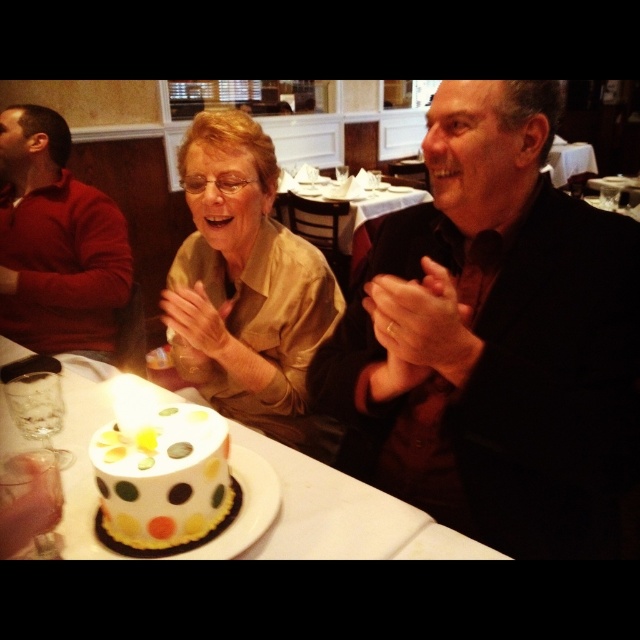
Which is in front, point (12, 205) or point (193, 428)?

Point (193, 428) is more forward.

Find the location of a particular element. Image resolution: width=640 pixels, height=640 pixels. matte red sweater at left is located at coordinates (56, 243).

At what (x,y) coordinates should I click in order to perform the action: click on matte red sweater at left. Please return your answer as a coordinate pair (x, y). Looking at the image, I should click on (56, 243).

Is point (384, 348) farther from viewer compared to point (449, 554)?

That is True.

Does matte black suit at center have a smaller size compared to white paper plate at center?

Incorrect, matte black suit at center is not smaller in size than white paper plate at center.

Describe the element at coordinates (496, 340) in the screenshot. I see `matte black suit at center` at that location.

This screenshot has width=640, height=640. Identify the location of matte black suit at center. (496, 340).

Can you confirm if matte gold blouse at center is positioned below white paper plate at center?

No.

Between point (244, 248) and point (64, 390), which one is positioned behind?

Positioned behind is point (244, 248).

Does point (252, 356) lie behind point (403, 520)?

Yes, it is behind point (403, 520).

You are a GUI agent. You are given a task and a screenshot of the screen. Output one action in this format:
    pyautogui.click(x=<x>, y=<y>)
    Task: Click on the matte gold blouse at center
    
    Given the screenshot: What is the action you would take?
    (248, 285)